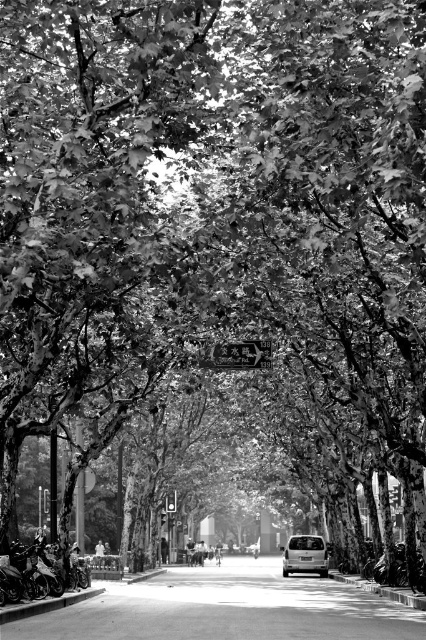
You are standing on the road in the image and want to find the metallic reflective sign at center. Which direction should you look to see it?

You should look towards the center of the road to see the metallic reflective sign at center, as it is located at point coordinates of (238, 355).